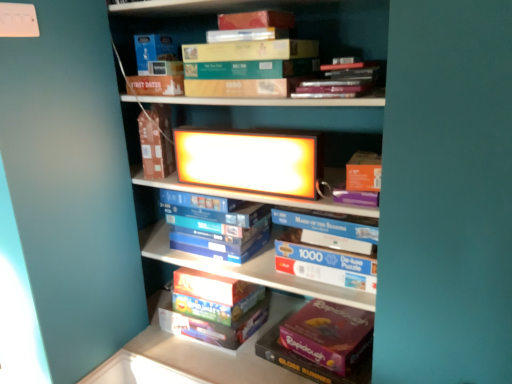
Question: From a real-world perspective, is matte green cardboard box at upper center, which is the first book from top to bottom, over matte cardboard book at upper center?

Choices:
 (A) no
 (B) yes

Answer: (B)

Question: Is matte green cardboard box at upper center, which appears as the 4th book when ordered from the bottom, shorter than matte cardboard book at upper center?

Choices:
 (A) no
 (B) yes

Answer: (B)

Question: Does matte green cardboard box at upper center, which is the first book from top to bottom, have a greater width compared to matte cardboard book at upper center?

Choices:
 (A) yes
 (B) no

Answer: (A)

Question: Is matte green cardboard box at upper center, which is the first book from top to bottom, bigger than matte cardboard book at upper center?

Choices:
 (A) yes
 (B) no

Answer: (A)

Question: From the image's perspective, is matte green cardboard box at upper center, which appears as the 4th book when ordered from the bottom, located above matte cardboard book at upper center?

Choices:
 (A) no
 (B) yes

Answer: (B)

Question: Is matte green cardboard box at upper center, which is the first book from top to bottom, facing away from matte cardboard book at upper center?

Choices:
 (A) no
 (B) yes

Answer: (A)

Question: Does blue cardboard box at center, the second book in the bottom-to-top sequence, have a larger size compared to matte cardboard book at upper center?

Choices:
 (A) no
 (B) yes

Answer: (B)

Question: Considering the relative sizes of blue cardboard box at center, the second book in the bottom-to-top sequence, and matte cardboard book at upper center in the image provided, is blue cardboard box at center, the second book in the bottom-to-top sequence, wider than matte cardboard book at upper center?

Choices:
 (A) yes
 (B) no

Answer: (B)

Question: From the image's perspective, is blue cardboard box at center, which is counted as the 3th book, starting from the top, above matte cardboard book at upper center?

Choices:
 (A) no
 (B) yes

Answer: (A)

Question: Is blue cardboard box at center, the second book in the bottom-to-top sequence, to the left of matte cardboard book at upper center from the viewer's perspective?

Choices:
 (A) no
 (B) yes

Answer: (A)

Question: From the image's perspective, would you say blue cardboard box at center, the second book in the bottom-to-top sequence, is shown under matte cardboard book at upper center?

Choices:
 (A) yes
 (B) no

Answer: (A)

Question: Could matte cardboard book at upper center be considered to be inside blue cardboard box at center, the second book in the bottom-to-top sequence?

Choices:
 (A) no
 (B) yes

Answer: (A)

Question: Is matte cardboard book at upper center at the left side of matte green cardboard box at upper center, which is the first book from top to bottom?

Choices:
 (A) no
 (B) yes

Answer: (B)